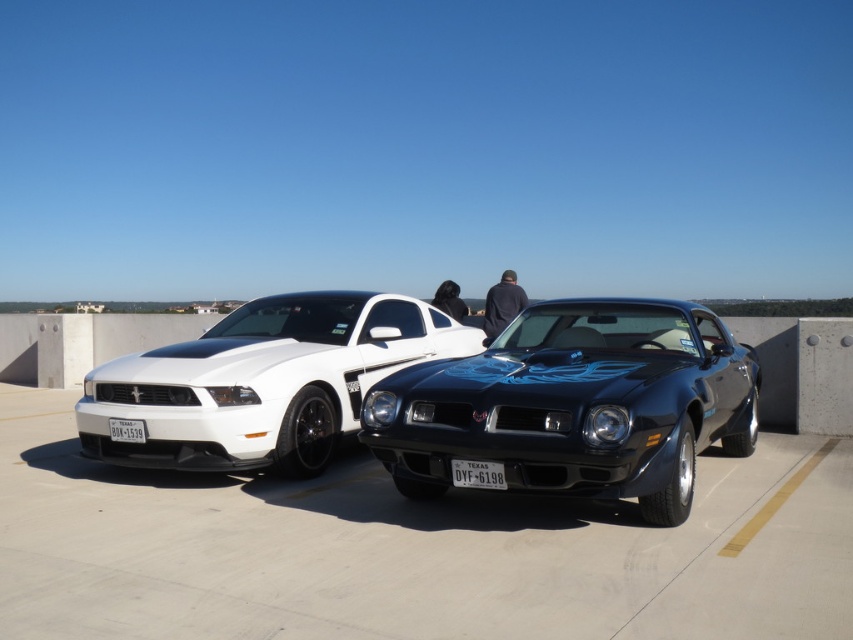
You are standing on the rooftop where the two classic muscle cars are parked. You notice a point marked at coordinates (575, 404). Which car is this point indicating?

The point marked at coordinates (575, 404) indicates the shiny black muscle car at center.

You are a photographer trying to capture the shiny black muscle car at center and the black plastic license plate at center in a single shot. Which object should you focus on first to ensure both are in sharp focus?

The shiny black muscle car at center is closer to the viewer than the black plastic license plate at center, so you should focus on the shiny black muscle car at center first to ensure both are in sharp focus.